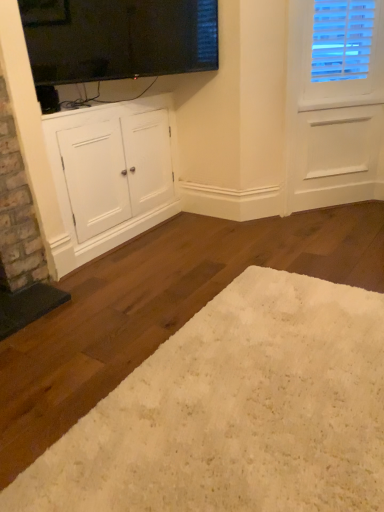
Question: Would you say white shag rug at lower center is part of white matte cabinet at lower left's contents?

Choices:
 (A) yes
 (B) no

Answer: (B)

Question: Is white matte cabinet at lower left thinner than white shag rug at lower center?

Choices:
 (A) yes
 (B) no

Answer: (A)

Question: Considering the relative positions of white matte cabinet at lower left and white shag rug at lower center in the image provided, is white matte cabinet at lower left to the right of white shag rug at lower center from the viewer's perspective?

Choices:
 (A) no
 (B) yes

Answer: (A)

Question: Does white matte cabinet at lower left have a lesser height compared to white shag rug at lower center?

Choices:
 (A) no
 (B) yes

Answer: (A)

Question: Is white matte cabinet at lower left next to white shag rug at lower center and touching it?

Choices:
 (A) no
 (B) yes

Answer: (A)

Question: Does point (158, 108) appear closer or farther from the camera than point (347, 458)?

Choices:
 (A) farther
 (B) closer

Answer: (A)

Question: In terms of width, does white matte cabinet at lower left look wider or thinner when compared to white shag rug at lower center?

Choices:
 (A) wide
 (B) thin

Answer: (B)

Question: Looking at the image, does white matte cabinet at lower left seem bigger or smaller compared to white shag rug at lower center?

Choices:
 (A) small
 (B) big

Answer: (B)

Question: Is white matte cabinet at lower left inside or outside of white shag rug at lower center?

Choices:
 (A) outside
 (B) inside

Answer: (A)

Question: In the image, is white shag rug at lower center positioned in front of or behind black glass window screen at upper center?

Choices:
 (A) behind
 (B) front

Answer: (B)

Question: From a real-world perspective, is white shag rug at lower center physically located above or below black glass window screen at upper center?

Choices:
 (A) above
 (B) below

Answer: (B)

Question: Considering the relative positions of white shag rug at lower center and black glass window screen at upper center in the image provided, is white shag rug at lower center to the left or to the right of black glass window screen at upper center?

Choices:
 (A) left
 (B) right

Answer: (B)

Question: Is white shag rug at lower center wider or thinner than black glass window screen at upper center?

Choices:
 (A) thin
 (B) wide

Answer: (B)

Question: Considering the positions of white matte cabinet at lower left and black glass window screen at upper center in the image, is white matte cabinet at lower left wider or thinner than black glass window screen at upper center?

Choices:
 (A) wide
 (B) thin

Answer: (A)

Question: Which is correct: white matte cabinet at lower left is inside black glass window screen at upper center, or outside of it?

Choices:
 (A) outside
 (B) inside

Answer: (A)